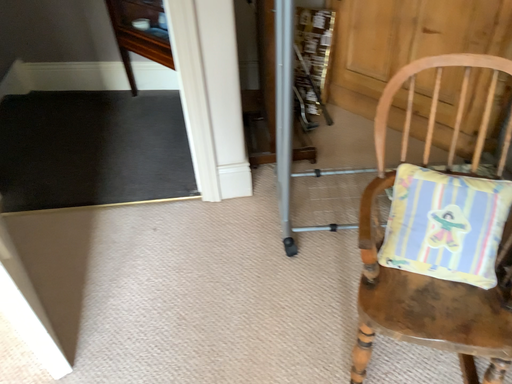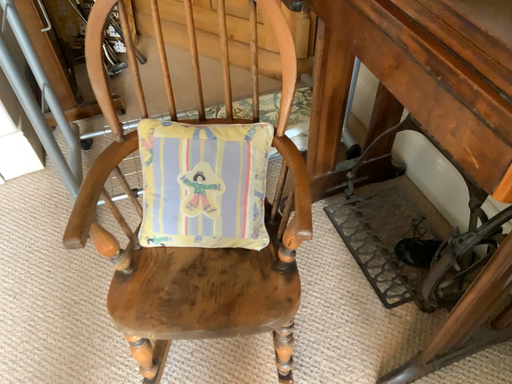
Question: How did the camera likely rotate when shooting the video?

Choices:
 (A) rotated left
 (B) rotated right

Answer: (B)